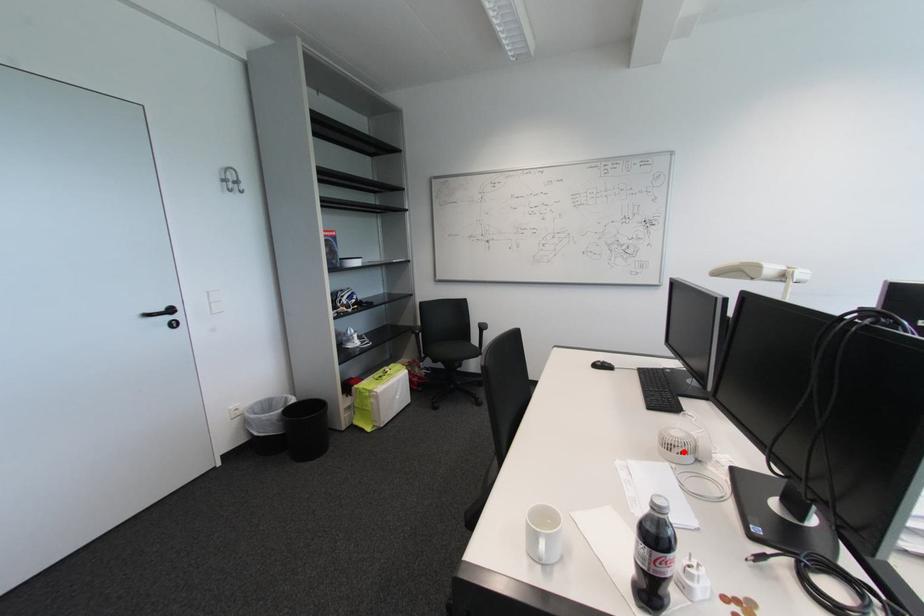
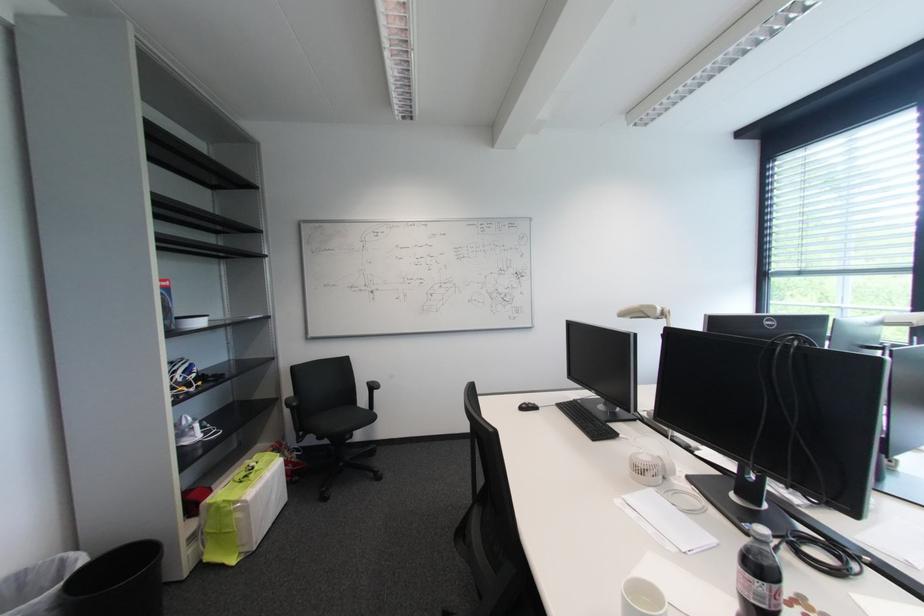
Find the pixel in the second image that matches the highlighted location in the first image.

(657, 475)